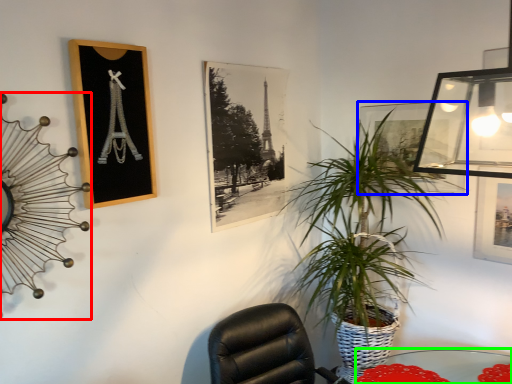
Question: Which object is the farthest from clock (highlighted by a red box)? Choose among these: picture frame (highlighted by a blue box) or table (highlighted by a green box).

Choices:
 (A) picture frame
 (B) table

Answer: (B)